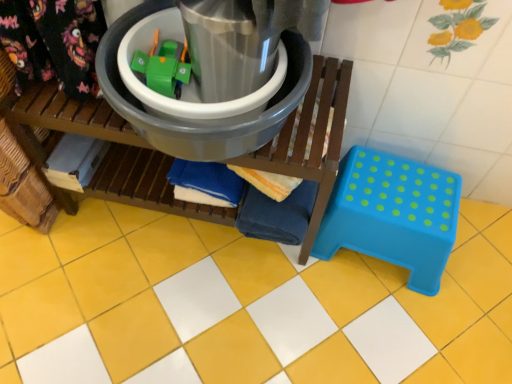
The image size is (512, 384). Find the location of `free spot in front of matte plastic bucket at center`. free spot in front of matte plastic bucket at center is located at coordinates (176, 311).